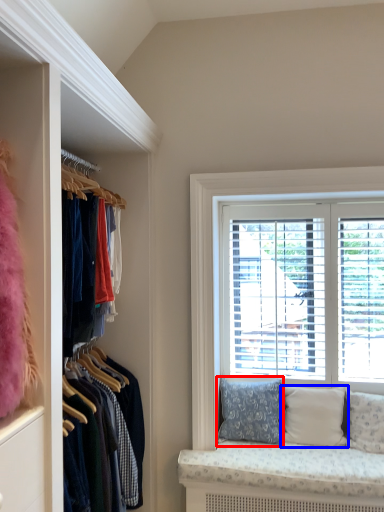
Question: Which point is further to the camera, pillow (highlighted by a red box) or pillow (highlighted by a blue box)?

Choices:
 (A) pillow
 (B) pillow

Answer: (A)